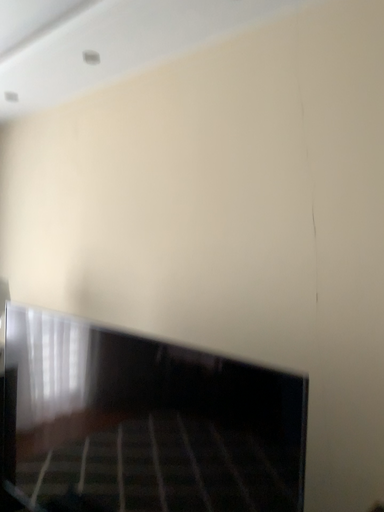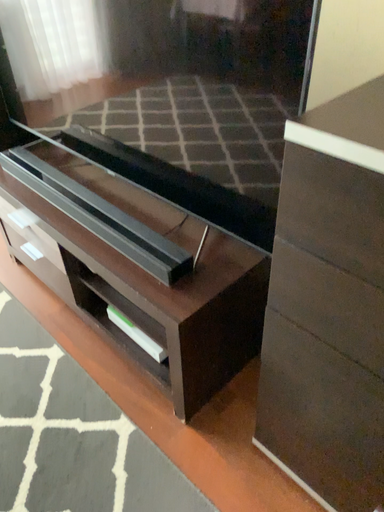
Question: How did the camera likely rotate when shooting the video?

Choices:
 (A) rotated upward
 (B) rotated downward

Answer: (B)